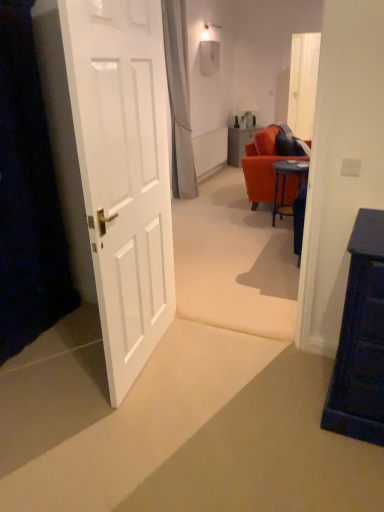
Question: Is the position of white glossy door at left less distant than that of blue glossy desk at center?

Choices:
 (A) yes
 (B) no

Answer: (A)

Question: Considering the relative positions of white glossy door at left and blue glossy desk at center in the image provided, is white glossy door at left to the right of blue glossy desk at center from the viewer's perspective?

Choices:
 (A) yes
 (B) no

Answer: (B)

Question: Is white glossy door at left oriented towards blue glossy desk at center?

Choices:
 (A) yes
 (B) no

Answer: (B)

Question: Can we say white glossy door at left lies outside blue glossy desk at center?

Choices:
 (A) yes
 (B) no

Answer: (A)

Question: Is white glossy door at left to the left of blue glossy desk at center from the viewer's perspective?

Choices:
 (A) yes
 (B) no

Answer: (A)

Question: Does point (236, 135) appear closer or farther from the camera than point (243, 112)?

Choices:
 (A) farther
 (B) closer

Answer: (B)

Question: Is matte orange table at center bigger or smaller than matte white lampshade at center?

Choices:
 (A) small
 (B) big

Answer: (B)

Question: Based on their positions, is matte orange table at center located to the left or right of matte white lampshade at center?

Choices:
 (A) right
 (B) left

Answer: (B)

Question: Relative to matte white lampshade at center, is matte orange table at center in front or behind?

Choices:
 (A) behind
 (B) front

Answer: (A)

Question: Considering the positions of point (152, 237) and point (274, 168), is point (152, 237) closer or farther from the camera than point (274, 168)?

Choices:
 (A) farther
 (B) closer

Answer: (B)

Question: Is white glossy door at left in front of or behind blue glossy desk at center in the image?

Choices:
 (A) front
 (B) behind

Answer: (A)

Question: Looking at the image, does white glossy door at left seem bigger or smaller compared to blue glossy desk at center?

Choices:
 (A) big
 (B) small

Answer: (A)

Question: Is white glossy door at left inside or outside of blue glossy desk at center?

Choices:
 (A) outside
 (B) inside

Answer: (A)

Question: Is white glossy door at left wider or thinner than matte orange table at center?

Choices:
 (A) thin
 (B) wide

Answer: (A)

Question: From their relative heights in the image, would you say white glossy door at left is taller or shorter than matte orange table at center?

Choices:
 (A) short
 (B) tall

Answer: (B)